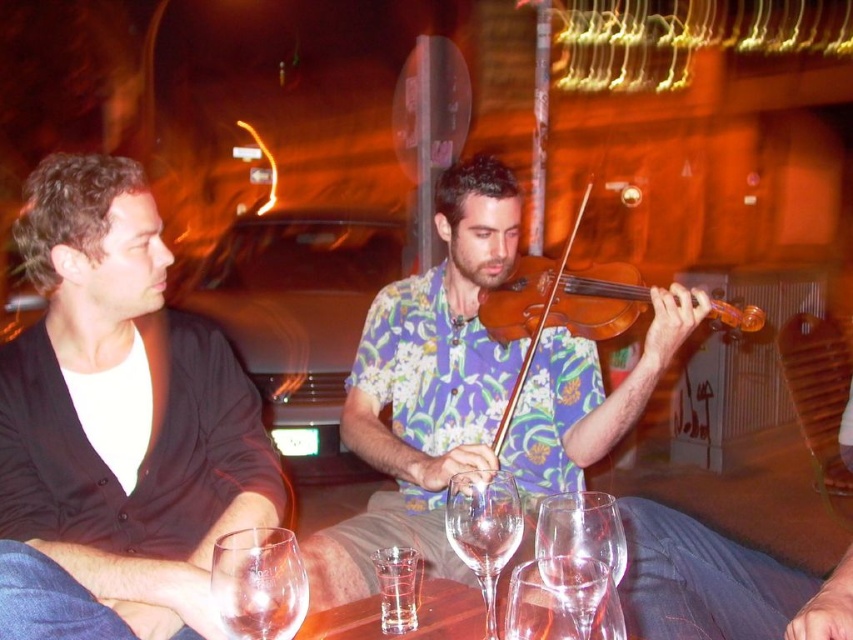
Is black matte shirt at left bigger than floral fabric shirt at center?

No, black matte shirt at left is not bigger than floral fabric shirt at center.

The width and height of the screenshot is (853, 640). In order to click on black matte shirt at left in this screenshot , I will do `click(117, 424)`.

Does black matte shirt at left have a lesser height compared to transparent glass wine at table center?

No, black matte shirt at left is not shorter than transparent glass wine at table center.

Is point (39, 579) positioned behind point (593, 557)?

Yes, point (39, 579) is behind point (593, 557).

In order to click on black matte shirt at left in this screenshot , I will do `click(117, 424)`.

Is the position of wooden violin at center more distant than that of clear glassware at center?

Yes.

Between wooden violin at center and clear glassware at center, which one appears on the right side from the viewer's perspective?

wooden violin at center

At what (x,y) coordinates should I click in order to perform the action: click on wooden violin at center. Please return your answer as a coordinate pair (x, y). The width and height of the screenshot is (853, 640). Looking at the image, I should click on (558, 307).